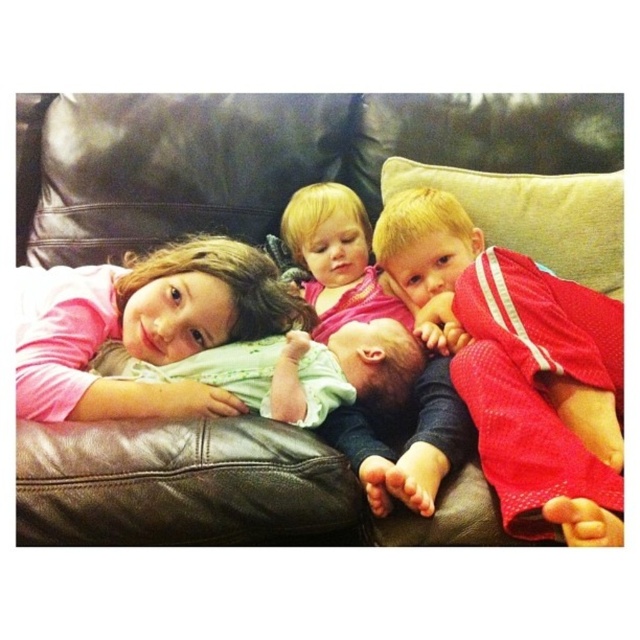
Question: Is brown leather couch at center wider than pink fabric baby at center?

Choices:
 (A) yes
 (B) no

Answer: (A)

Question: Among these objects, which one is farthest from the camera?

Choices:
 (A) brown leather couch at center
 (B) pink matte shirt at upper left

Answer: (A)

Question: Does pink matte shirt at upper left appear on the right side of soft green fabric baby at center?

Choices:
 (A) no
 (B) yes

Answer: (A)

Question: Does brown leather couch at center have a smaller size compared to pink fabric baby at center?

Choices:
 (A) yes
 (B) no

Answer: (B)

Question: Which object is farther from the camera taking this photo?

Choices:
 (A) pink matte shirt at upper left
 (B) brown leather couch at center

Answer: (B)

Question: Which of the following is the farthest from the observer?

Choices:
 (A) (566, 429)
 (B) (157, 305)
 (C) (406, 324)
 (D) (460, 540)

Answer: (C)